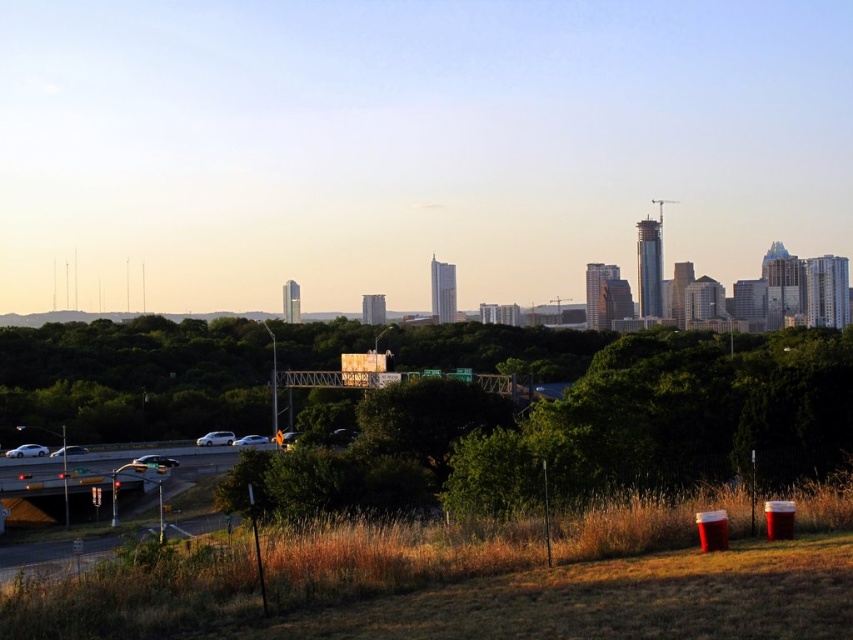
You are a pedestrian standing on the grassy area near the metal fence. You see the satin black sedan at lower center and the silver metallic car at lower left on the highway. Which car is taller?

The satin black sedan at lower center is taller than the silver metallic car at lower left.

You are a pedestrian standing on the grassy area near the metal fence. You see a white matte car at lower left and a silver metallic sedan at lower left. Which vehicle is closer to you?

The white matte car at lower left is shorter than the silver metallic sedan at lower left, so it might be closer to you since shorter objects appear closer when they are positioned similarly.

You are a delivery driver who needs to park your vehicle in the grassy area near the metal fence. The satin black sedan at lower center and the silver metallic car at lower left are already parked there. Which car takes up more space in the parking area?

The satin black sedan at lower center takes up more space in the parking area because it is larger in size than the silver metallic car at lower left.